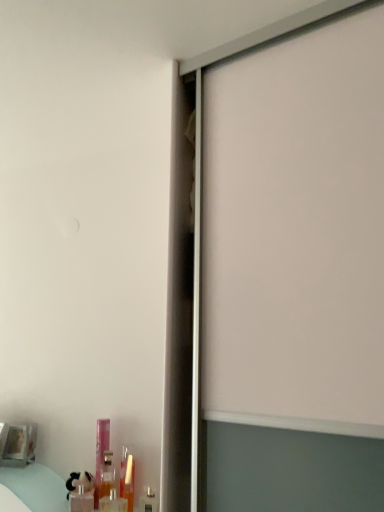
Question: Considering the relative sizes of translucent plastic tube at lower left, which is the 4th toiletry in left-to-right order, and translucent plastic bottle at lower left, arranged as the first toiletry when viewed from the left, in the image provided, is translucent plastic tube at lower left, which is the 4th toiletry in left-to-right order, shorter than translucent plastic bottle at lower left, arranged as the first toiletry when viewed from the left,?

Choices:
 (A) no
 (B) yes

Answer: (A)

Question: Does translucent plastic tube at lower left, which is the 4th toiletry in left-to-right order, have a greater height compared to translucent plastic bottle at lower left, arranged as the first toiletry when viewed from the left?

Choices:
 (A) no
 (B) yes

Answer: (B)

Question: Would you say translucent plastic tube at lower left, which is the 4th toiletry in left-to-right order, is a long distance from translucent plastic bottle at lower left, placed as the 5th toiletry when sorted from right to left?

Choices:
 (A) no
 (B) yes

Answer: (A)

Question: Is translucent plastic tube at lower left, marked as the 2th toiletry in a right-to-left arrangement, thinner than translucent plastic bottle at lower left, placed as the 5th toiletry when sorted from right to left?

Choices:
 (A) yes
 (B) no

Answer: (A)

Question: Can you confirm if translucent plastic tube at lower left, which is the 4th toiletry in left-to-right order, is positioned to the right of translucent plastic bottle at lower left, placed as the 5th toiletry when sorted from right to left?

Choices:
 (A) yes
 (B) no

Answer: (A)

Question: Is translucent plastic tube at lower left, marked as the 2th toiletry in a right-to-left arrangement, further to camera compared to translucent plastic bottle at lower left, placed as the 5th toiletry when sorted from right to left?

Choices:
 (A) no
 (B) yes

Answer: (A)

Question: Can you confirm if pink plastic bottle at lower left, the 4th toiletry positioned from the right, is taller than metallic silver toiletry at lower left, which is counted as the fifth toiletry, starting from the left?

Choices:
 (A) yes
 (B) no

Answer: (A)

Question: From the image's perspective, is pink plastic bottle at lower left, the second toiletry in the left-to-right sequence, located above metallic silver toiletry at lower left, which is counted as the fifth toiletry, starting from the left?

Choices:
 (A) yes
 (B) no

Answer: (A)

Question: Is pink plastic bottle at lower left, the 4th toiletry positioned from the right, closer to the viewer compared to metallic silver toiletry at lower left, placed as the first toiletry when sorted from right to left?

Choices:
 (A) no
 (B) yes

Answer: (A)

Question: Is metallic silver toiletry at lower left, placed as the first toiletry when sorted from right to left, a part of pink plastic bottle at lower left, the second toiletry in the left-to-right sequence?

Choices:
 (A) no
 (B) yes

Answer: (A)

Question: Does pink plastic bottle at lower left, the 4th toiletry positioned from the right, have a larger size compared to metallic silver toiletry at lower left, which is counted as the fifth toiletry, starting from the left?

Choices:
 (A) no
 (B) yes

Answer: (B)

Question: From a real-world perspective, is pink plastic bottle at lower left, the second toiletry in the left-to-right sequence, below metallic silver toiletry at lower left, placed as the first toiletry when sorted from right to left?

Choices:
 (A) no
 (B) yes

Answer: (A)

Question: Can pink plastic bottle at lower left, the 4th toiletry positioned from the right, be found inside translucent plastic bottle at lower left, placed as the 3th toiletry when sorted from right to left?

Choices:
 (A) yes
 (B) no

Answer: (B)